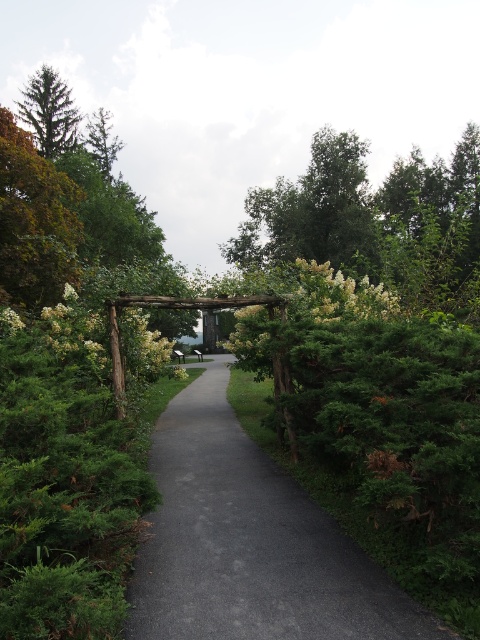
Question: From the image, what is the correct spatial relationship of black asphalt driveway at center in relation to white fluffy flowers at upper right?

Choices:
 (A) below
 (B) above

Answer: (A)

Question: Does black asphalt driveway at center appear over green matte tree at upper left?

Choices:
 (A) no
 (B) yes

Answer: (A)

Question: Which object is closer to the camera taking this photo?

Choices:
 (A) green matte evergreen tree at upper left
 (B) white fluffy flowers at upper right
 (C) black asphalt driveway at center

Answer: (C)

Question: Which object appears farthest from the camera in this image?

Choices:
 (A) black asphalt driveway at center
 (B) green leafy tree at upper center

Answer: (B)

Question: Is black asphalt driveway at center behind green leafy tree at upper center?

Choices:
 (A) no
 (B) yes

Answer: (A)

Question: Which of these objects is positioned closest to the white fluffy flowers at upper right?

Choices:
 (A) green leafy tree at upper center
 (B) green matte evergreen tree at upper left
 (C) white fluffy flowers at center
 (D) green matte tree at upper left

Answer: (C)